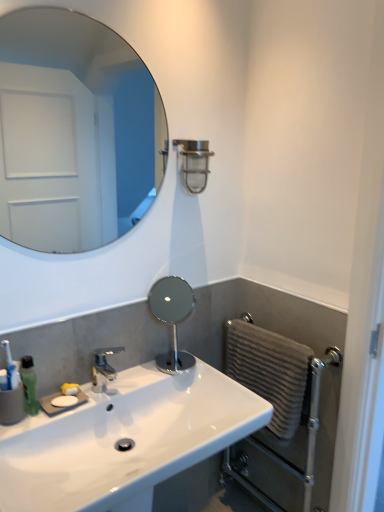
Question: Does gray textured towel at right have a greater height compared to satin nickel shower at upper center?

Choices:
 (A) no
 (B) yes

Answer: (B)

Question: From a real-world perspective, is gray textured towel at right below satin nickel shower at upper center?

Choices:
 (A) no
 (B) yes

Answer: (B)

Question: Is gray textured towel at right oriented towards satin nickel shower at upper center?

Choices:
 (A) no
 (B) yes

Answer: (A)

Question: Can you confirm if gray textured towel at right is wider than satin nickel shower at upper center?

Choices:
 (A) yes
 (B) no

Answer: (B)

Question: Can you confirm if gray textured towel at right is shorter than satin nickel shower at upper center?

Choices:
 (A) no
 (B) yes

Answer: (A)

Question: In terms of width, does polished silver mirror at center, positioned as the first mirror in bottom-to-top order, look wider or thinner when compared to white glossy mirror at upper left, marked as the second mirror in a bottom-to-top arrangement?

Choices:
 (A) thin
 (B) wide

Answer: (B)

Question: Is point (180, 278) positioned closer to the camera than point (105, 76)?

Choices:
 (A) closer
 (B) farther

Answer: (A)

Question: Do you think polished silver mirror at center, positioned as the first mirror in bottom-to-top order, is within white glossy mirror at upper left, marked as the second mirror in a bottom-to-top arrangement, or outside of it?

Choices:
 (A) outside
 (B) inside

Answer: (A)

Question: Considering the positions of polished silver mirror at center, positioned as the first mirror in bottom-to-top order, and white glossy mirror at upper left, arranged as the 1th mirror when viewed from the top, in the image, is polished silver mirror at center, positioned as the first mirror in bottom-to-top order, taller or shorter than white glossy mirror at upper left, arranged as the 1th mirror when viewed from the top,?

Choices:
 (A) short
 (B) tall

Answer: (A)

Question: From a real-world perspective, is green translucent soap dispenser at lower left physically located above or below polished silver mirror at center, positioned as the first mirror in bottom-to-top order?

Choices:
 (A) above
 (B) below

Answer: (B)

Question: Based on their sizes in the image, would you say green translucent soap dispenser at lower left is bigger or smaller than polished silver mirror at center, positioned as the first mirror in bottom-to-top order?

Choices:
 (A) big
 (B) small

Answer: (B)

Question: Would you say green translucent soap dispenser at lower left is to the left or to the right of polished silver mirror at center, acting as the 2th mirror starting from the top, in the picture?

Choices:
 (A) right
 (B) left

Answer: (B)

Question: Considering the positions of point (34, 381) and point (175, 276), is point (34, 381) closer or farther from the camera than point (175, 276)?

Choices:
 (A) farther
 (B) closer

Answer: (B)

Question: Based on their positions, is green translucent soap dispenser at lower left located to the left or right of gray textured towel at right?

Choices:
 (A) right
 (B) left

Answer: (B)

Question: Considering the positions of green translucent soap dispenser at lower left and gray textured towel at right in the image, is green translucent soap dispenser at lower left taller or shorter than gray textured towel at right?

Choices:
 (A) tall
 (B) short

Answer: (B)